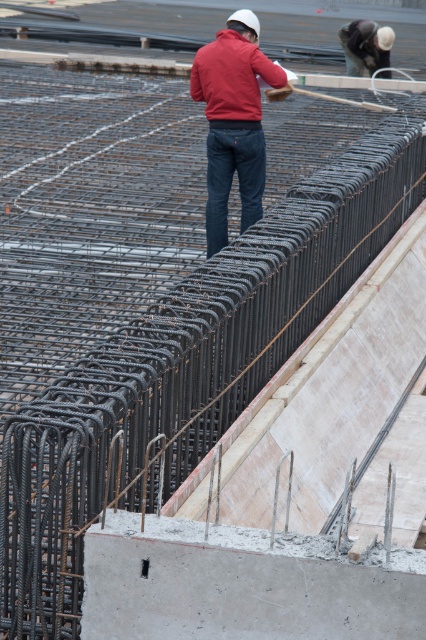
Question: Which point is farther from the camera taking this photo?

Choices:
 (A) (164, 628)
 (B) (232, 109)
 (C) (362, 26)
 (D) (190, 72)

Answer: (C)

Question: Considering the real-world distances, which object is closest to the matte white helmet at upper center?

Choices:
 (A) red matte jacket at center
 (B) matte red jacket at center

Answer: (A)

Question: Is red matte jacket at center above matte red jacket at center?

Choices:
 (A) no
 (B) yes

Answer: (A)

Question: Can you confirm if red matte jacket at center is smaller than matte red jacket at center?

Choices:
 (A) yes
 (B) no

Answer: (B)

Question: Can you confirm if gray concrete at lower center is wider than red matte jacket at center?

Choices:
 (A) yes
 (B) no

Answer: (A)

Question: Among these objects, which one is farthest from the camera?

Choices:
 (A) gray concrete at lower center
 (B) matte white helmet at upper center

Answer: (B)